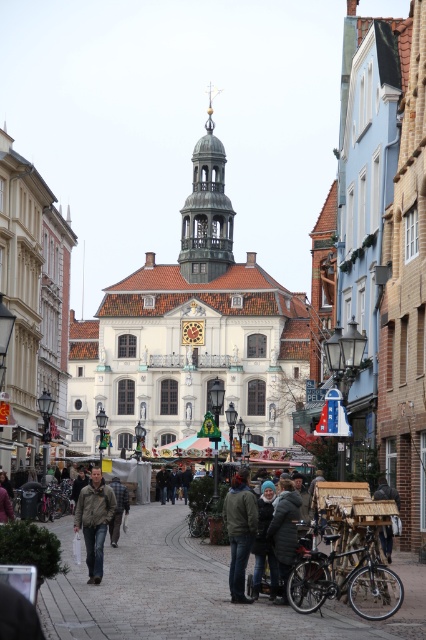
Question: Which point is closer to the camera taking this photo?

Choices:
 (A) click(x=232, y=545)
 (B) click(x=88, y=513)

Answer: (A)

Question: Is dark green jacket at center thinner than leather jacket at center?

Choices:
 (A) yes
 (B) no

Answer: (A)

Question: Which point is closer to the camera?

Choices:
 (A) (100, 488)
 (B) (244, 582)

Answer: (B)

Question: Which point is farther to the camera?

Choices:
 (A) (x=88, y=534)
 (B) (x=232, y=500)

Answer: (A)

Question: From the image, what is the correct spatial relationship of dark green jacket at center in relation to leather jacket at center?

Choices:
 (A) left
 (B) right

Answer: (B)

Question: Does dark green jacket at center have a greater width compared to leather jacket at center?

Choices:
 (A) no
 (B) yes

Answer: (A)